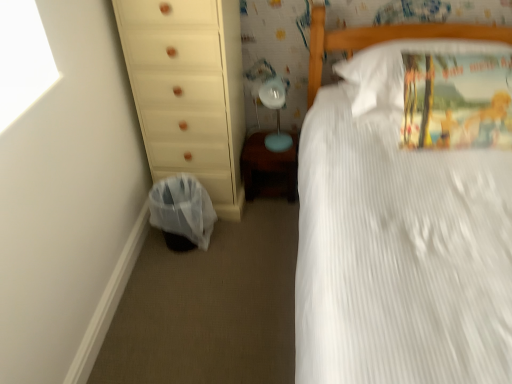
At what (x,y) coordinates should I click in order to perform the action: click on vacant space in front of wooden changing table at lower center. Please return your answer as a coordinate pair (x, y). Image resolution: width=512 pixels, height=384 pixels. Looking at the image, I should click on (266, 215).